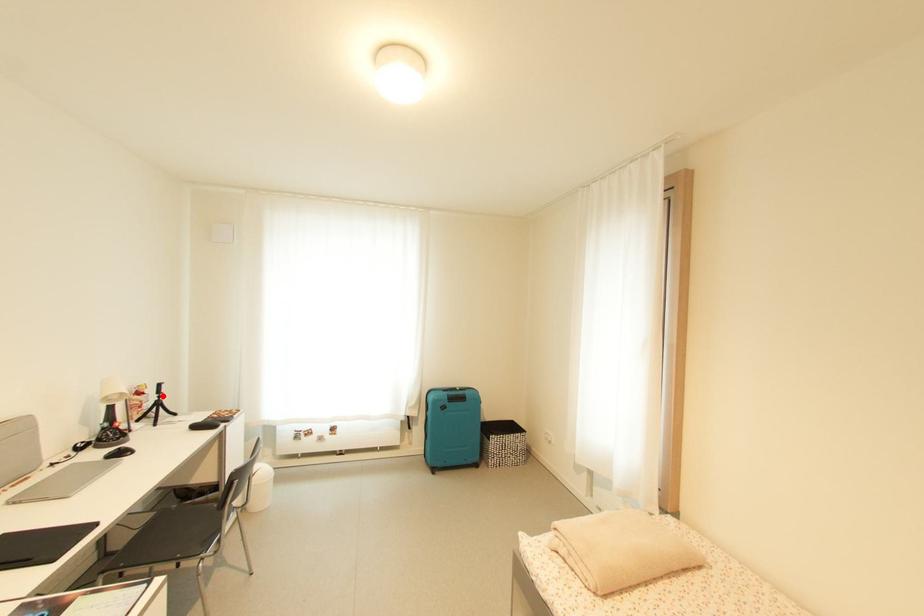
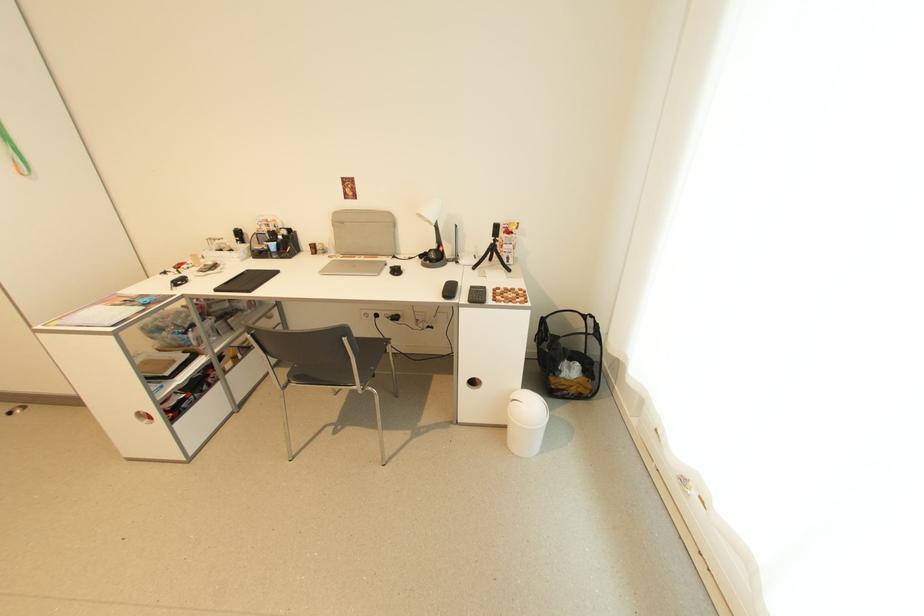
Question: I am providing you with two images of the same scene from different viewpoints. A red point is shown in image1. For the corresponding object point in image2, is it positioned nearer or farther from the camera?

Choices:
 (A) Nearer
 (B) Farther

Answer: (A)